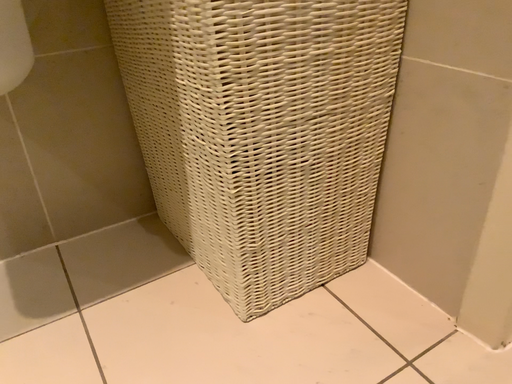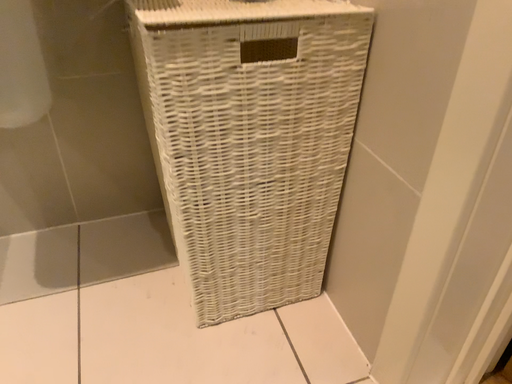
Question: How did the camera likely rotate when shooting the video?

Choices:
 (A) rotated left
 (B) rotated right

Answer: (A)